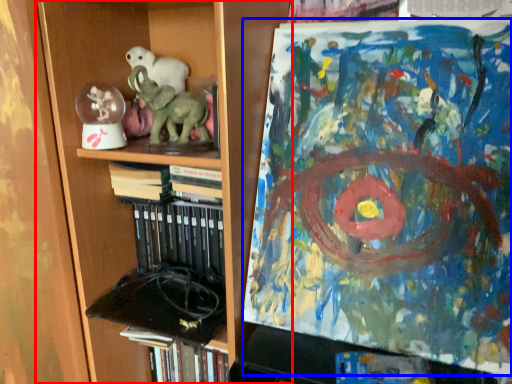
Question: Among these objects, which one is farthest to the camera, bookcase (highlighted by a red box) or art (highlighted by a blue box)?

Choices:
 (A) bookcase
 (B) art

Answer: (A)